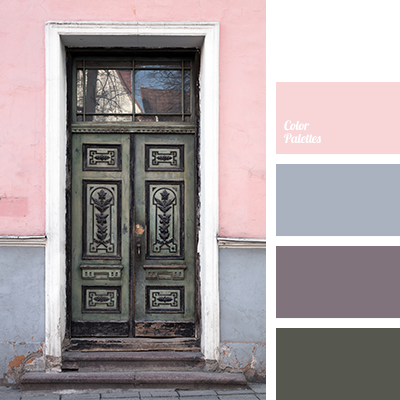
At what (x,y) coordinates should I click in order to perform the action: click on threshold. Please return your answer as a coordinate pair (x, y). The image size is (400, 400). Looking at the image, I should click on (131, 339).